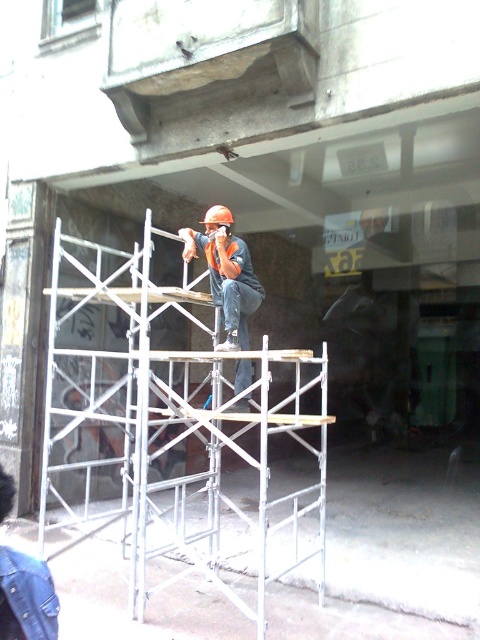
Question: Which of the following is the farthest from the observer?

Choices:
 (A) (225, 212)
 (B) (51, 420)
 (C) (214, 275)

Answer: (B)

Question: Is orange hard hat at center thinner than hard hat at center?

Choices:
 (A) no
 (B) yes

Answer: (A)

Question: Where is silver metallic scaffolding at center located in relation to orange hard hat at center in the image?

Choices:
 (A) below
 (B) above

Answer: (A)

Question: Considering the relative positions of silver metallic scaffolding at center and hard hat at center in the image provided, where is silver metallic scaffolding at center located with respect to hard hat at center?

Choices:
 (A) below
 (B) above

Answer: (A)

Question: Which point appears farthest from the camera in this image?

Choices:
 (A) (227, 218)
 (B) (228, 499)
 (C) (247, 330)

Answer: (C)

Question: Which object is the closest to the orange hard hat at center?

Choices:
 (A) hard hat at center
 (B) silver metallic scaffolding at center

Answer: (B)